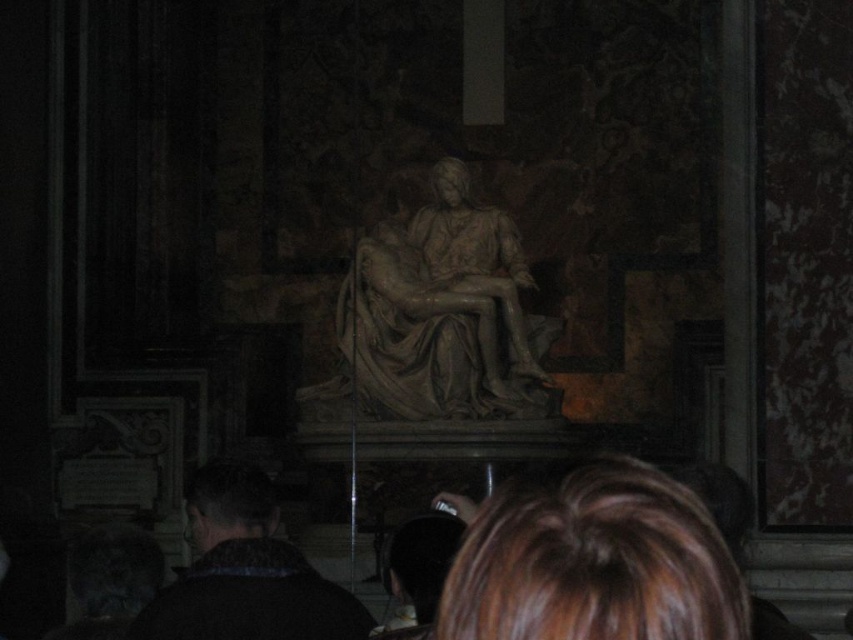
Is point (585, 632) positioned before point (544, 376)?

Yes.

Is brown hair at lower center thinner than gray stone sculpture at center?

Yes, brown hair at lower center is thinner than gray stone sculpture at center.

Where is `brown hair at lower center`? The width and height of the screenshot is (853, 640). brown hair at lower center is located at coordinates (590, 561).

Is point (509, 337) farther from viewer compared to point (241, 513)?

Yes, point (509, 337) is behind point (241, 513).

Which is more to the right, gray stone sculpture at center or black woolen sweater at lower left?

Positioned to the right is gray stone sculpture at center.

Measure the distance between gray stone sculpture at center and camera.

They are 244.52 feet apart.

Where is `gray stone sculpture at center`? The height and width of the screenshot is (640, 853). gray stone sculpture at center is located at coordinates (438, 317).

Does brown hair at lower center appear under black woolen sweater at lower left?

Actually, brown hair at lower center is above black woolen sweater at lower left.

Which is more to the left, brown hair at lower center or black woolen sweater at lower left?

Positioned to the left is black woolen sweater at lower left.

Does point (738, 611) come farther from viewer compared to point (271, 532)?

That is False.

The image size is (853, 640). Find the location of `brown hair at lower center`. brown hair at lower center is located at coordinates (590, 561).